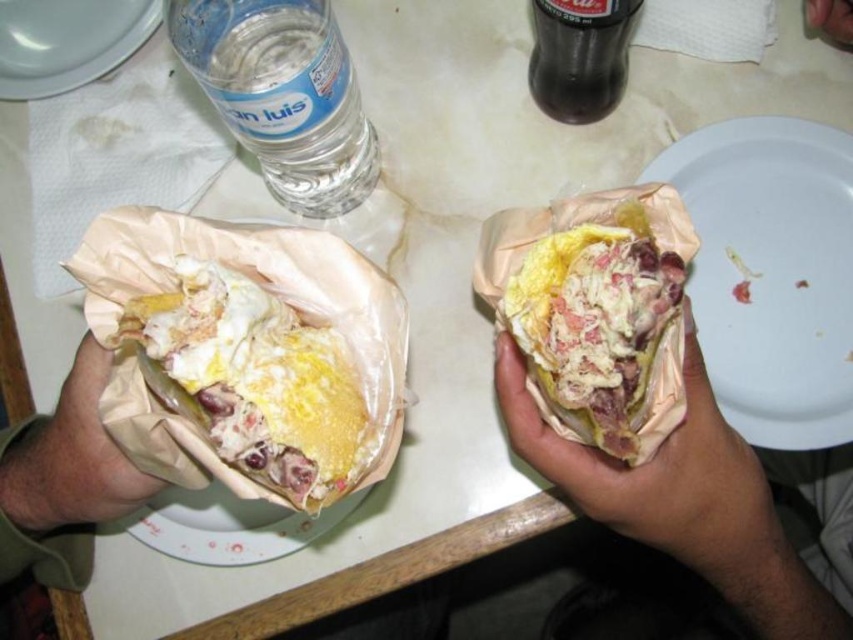
Is point (337, 474) farther from viewer compared to point (370, 131)?

No, it is in front of (370, 131).

Is the position of yellowish paper-wrapped sandwich at left less distant than that of clear plastic bottle at upper left?

Yes, yellowish paper-wrapped sandwich at left is closer to the viewer.

Does point (263, 296) come in front of point (341, 212)?

Yes, point (263, 296) is closer to viewer.

Where is `yellowish paper-wrapped sandwich at left`? yellowish paper-wrapped sandwich at left is located at coordinates (252, 380).

Can you confirm if yellowish paper-wrapped sandwich at left is positioned to the right of dark glass bottle at upper center?

In fact, yellowish paper-wrapped sandwich at left is to the left of dark glass bottle at upper center.

Does point (253, 304) come farther from viewer compared to point (544, 1)?

No, (253, 304) is in front of (544, 1).

Find the location of a particular element. yellowish paper-wrapped sandwich at left is located at coordinates (252, 380).

Who is positioned more to the left, yellowish paper-wrapped sandwich at left or white glossy plate at upper left?

white glossy plate at upper left

Who is more distant from viewer, (x=271, y=307) or (x=20, y=67)?

The point (x=20, y=67) is behind.

Which is in front, point (318, 384) or point (149, 6)?

Point (318, 384) is more forward.

Where is `yellowish paper-wrapped sandwich at left`? The height and width of the screenshot is (640, 853). yellowish paper-wrapped sandwich at left is located at coordinates (252, 380).